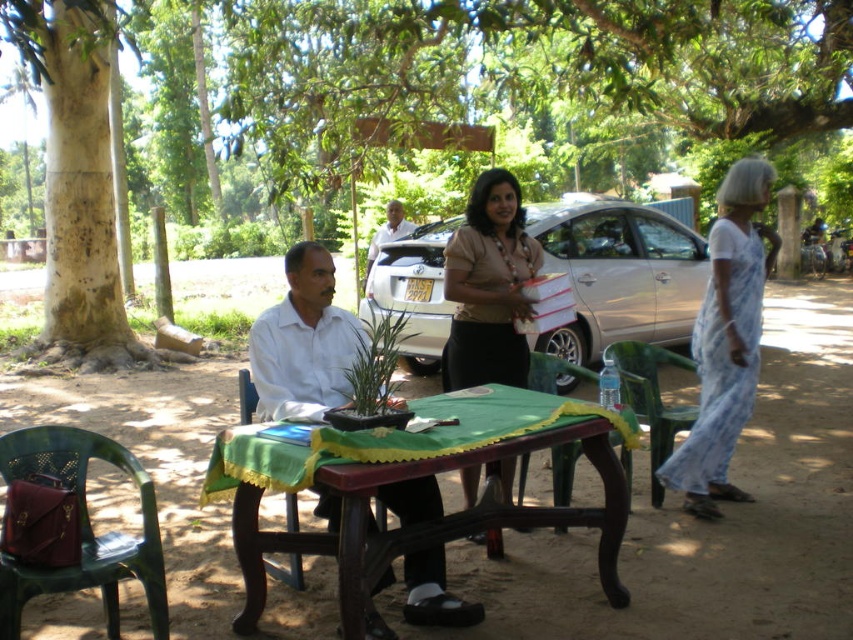
Question: Can you confirm if white cotton dress at right is thinner than white glossy shirt at center?

Choices:
 (A) yes
 (B) no

Answer: (B)

Question: Does white matte shirt at center have a larger size compared to white cotton dress at right?

Choices:
 (A) yes
 (B) no

Answer: (B)

Question: Does wooden picnic table at center appear on the left side of silver metallic car at center?

Choices:
 (A) no
 (B) yes

Answer: (B)

Question: Which object is the closest to the rough bark tree at left?

Choices:
 (A) silver metallic car at center
 (B) wooden picnic table at center
 (C) white cotton dress at right
 (D) wooden chair at center

Answer: (A)

Question: Which point is closer to the camera?

Choices:
 (A) (247, 392)
 (B) (265, 548)

Answer: (B)

Question: Which of the following is the farthest from the observer?

Choices:
 (A) (693, 275)
 (B) (711, 464)
 (C) (398, 236)
 (D) (49, 61)

Answer: (C)